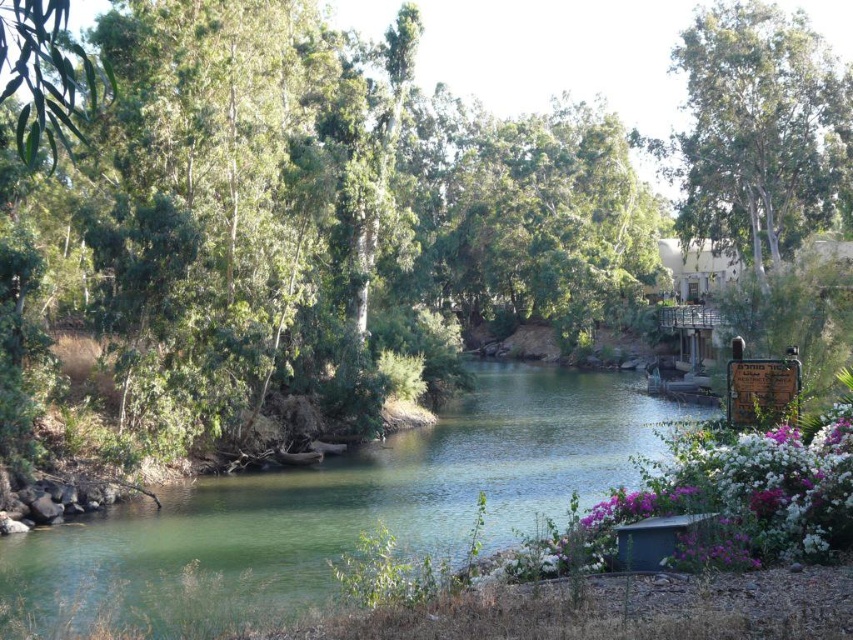
Which is below, green smooth water at center or white matte flowers at lower right?

Positioned lower is green smooth water at center.

Does point (376, 512) come behind point (849, 410)?

Yes.

Locate an element on the screen. The height and width of the screenshot is (640, 853). green smooth water at center is located at coordinates tap(341, 508).

Who is more forward, (16, 404) or (810, 550)?

Point (810, 550) is in front.

Does green leafy tree at center have a greater height compared to white matte flowers at lower right?

Correct, green leafy tree at center is much taller as white matte flowers at lower right.

The height and width of the screenshot is (640, 853). I want to click on green leafy tree at center, so click(x=285, y=212).

Where is `green leafy tree at center`? green leafy tree at center is located at coordinates (285, 212).

Which is behind, point (593, 227) or point (234, 504)?

The point (593, 227) is more distant.

Does green leafy tree at center have a lesser width compared to green smooth water at center?

No, green leafy tree at center is not thinner than green smooth water at center.

I want to click on green leafy tree at center, so click(285, 212).

In order to click on green leafy tree at center in this screenshot , I will do `click(285, 212)`.